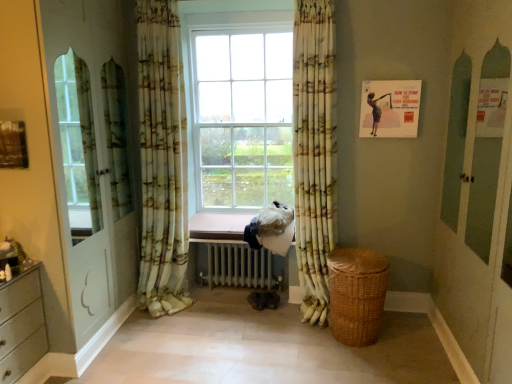
Where is `vacant space situated on the left part of woven brown basket at lower right`? This screenshot has width=512, height=384. vacant space situated on the left part of woven brown basket at lower right is located at coordinates [303, 352].